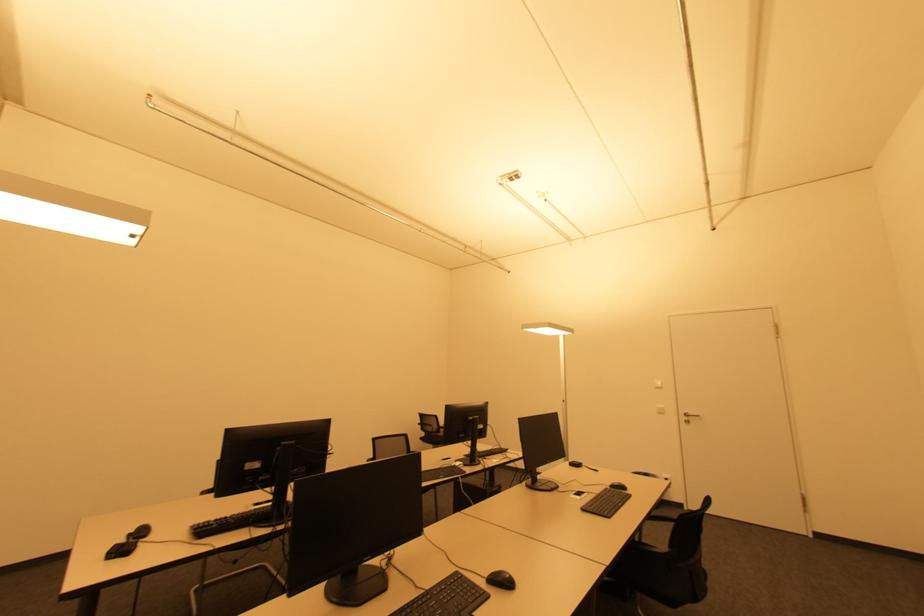
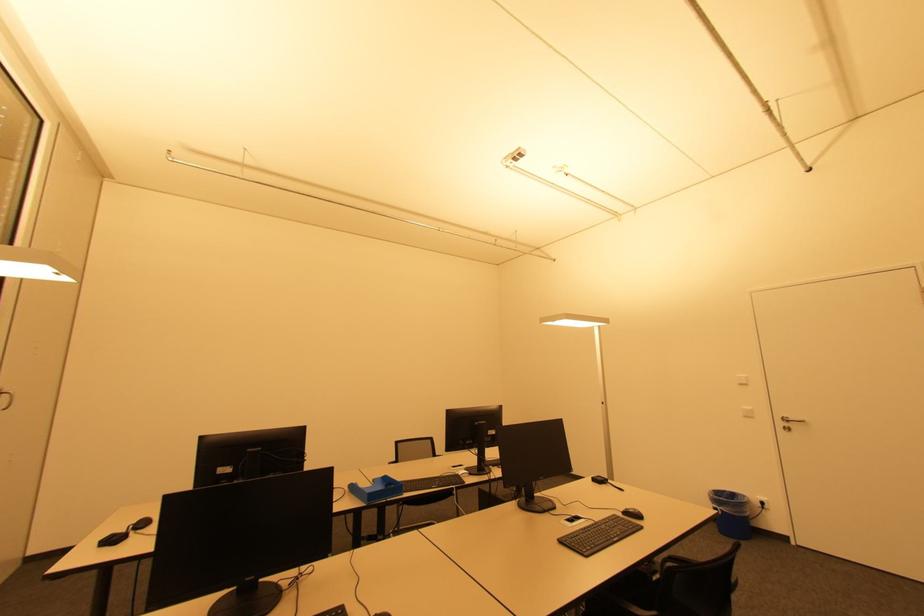
Question: The camera is either moving clockwise (left) or counter-clockwise (right) around the object. The first image is from the beginning of the video and the second image is from the end. Is the camera moving left or right when shooting the video?

Choices:
 (A) Left
 (B) Right

Answer: (B)